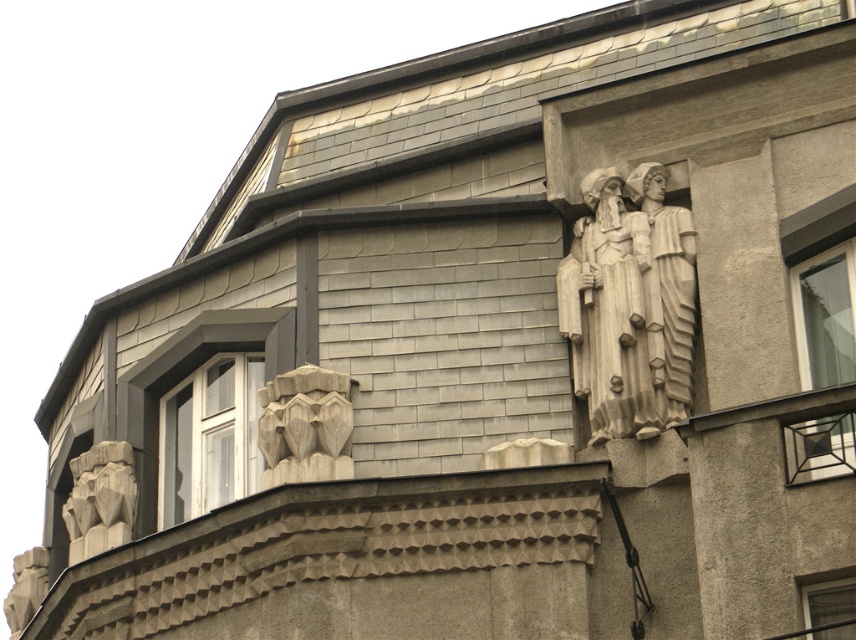
You are standing in front of the building and looking at its facade. There are two points marked on the image, point 1 at coordinates (843, 435) and point 2 at (851, 627). Which point is closer to your eyes?

Point 1 at coordinates (843, 435) is further to the camera than point 2 at (851, 627), so point 2 is closer to your eyes.

You are an architect designing a new building and want to ensure there is enough space between the carved stone mask at center and the gray stone carving at lower left for a maintenance ladder. The ladder requires a minimum of 6 meters of space. Can the ladder fit between them?

The carved stone mask at center is 7.22 meters from the gray stone carving at lower left, which is more than the required 6 meters, so the ladder can fit between them.

You are a window cleaner standing at the camera position. You need to clean the white glass window at upper right. Can you reach it with a 100 feet long pole?

The white glass window at upper right and camera are 142.09 feet apart, so the 100 feet long pole is not long enough to reach the window.